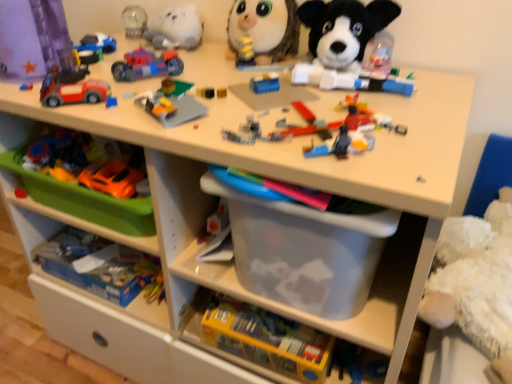
Locate an element on the screen. free space behind orange matte car at left, acting as the seventh toy starting from the top is located at coordinates (115, 155).